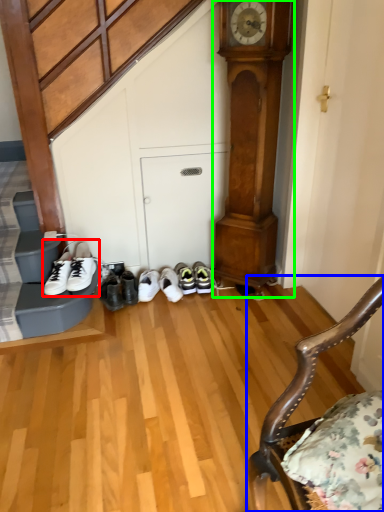
Question: Which is farther away from footwear (highlighted by a red box)? chair (highlighted by a blue box) or clock (highlighted by a green box)?

Choices:
 (A) chair
 (B) clock

Answer: (A)